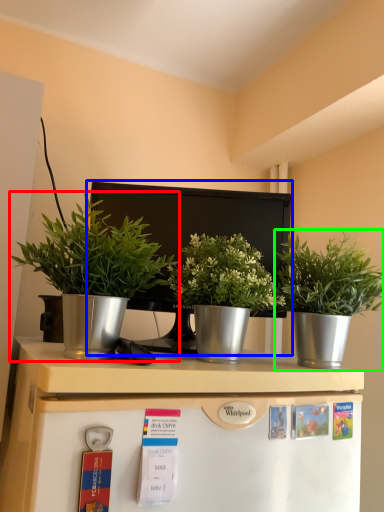
Question: Which is farther away from houseplant (highlighted by a red box)? appliance (highlighted by a blue box) or houseplant (highlighted by a green box)?

Choices:
 (A) appliance
 (B) houseplant

Answer: (B)